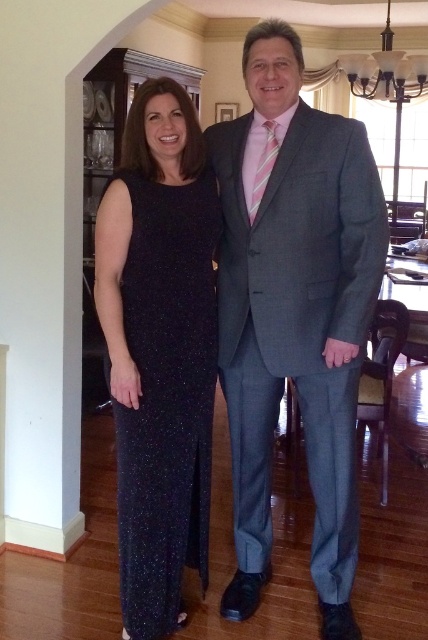
From the picture: You are a photographer adjusting the framing for a group photo. You notice the sparkly dark blue dress at center and the pink striped tie at center in your viewfinder. Which object should you ensure is more in focus if you want to highlight the larger one?

The sparkly dark blue dress at center has a larger size compared to the pink striped tie at center, so you should ensure the sparkly dark blue dress at center is more in focus to highlight the larger one.

You are a photographer adjusting the framing for a group photo. You notice the gray wool suit at center and the pink striped tie at center. Which of these two items requires more space in the frame to be fully visible?

The gray wool suit at center requires more space in the frame to be fully visible because it is larger in size than the pink striped tie at center.

You are a photographer setting up for a group photo. You need to ensure there is enough space between the gray wool suit at center and the sparkly dark blue dress at center so that the camera can capture both clearly. The minimum required distance for clear capture is 30 centimeters. Based on the scene, is the current distance sufficient?

The gray wool suit at center is 28.56 centimeters from the sparkly dark blue dress at center. Since the minimum required distance is 30 centimeters, the current distance is insufficient. They need to move slightly apart to meet the requirement.